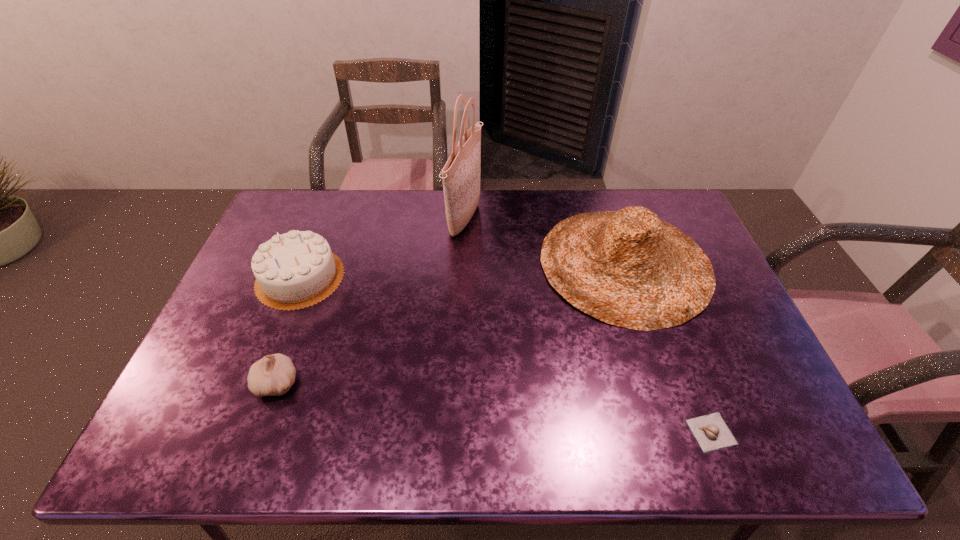
Locate an element on the screen. This screenshot has height=540, width=960. the third object from left to right is located at coordinates (461, 174).

Identify the location of the tallest object. The height and width of the screenshot is (540, 960). (461, 174).

Identify the location of the second tallest object. The width and height of the screenshot is (960, 540). (628, 268).

Image resolution: width=960 pixels, height=540 pixels. Identify the location of the third shortest object. (295, 270).

Identify the location of the fourth farthest object. (274, 374).

Where is `the left garlic`? The width and height of the screenshot is (960, 540). the left garlic is located at coordinates (274, 374).

This screenshot has height=540, width=960. Identify the location of the shortest object. (711, 432).

Where is `the nearer garlic`? This screenshot has height=540, width=960. the nearer garlic is located at coordinates (711, 432).

The width and height of the screenshot is (960, 540). What are the coordinates of `vacant space located 0.360m on the right of the tallest object` in the screenshot? It's located at (586, 220).

What are the coordinates of `free region located on the front of the sunhat` in the screenshot? It's located at pos(653,349).